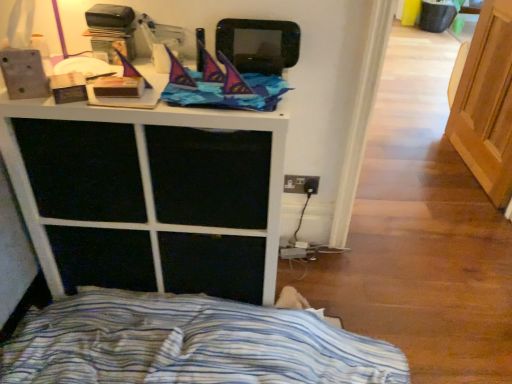
The width and height of the screenshot is (512, 384). Find the location of `blue striped fabric at lower left`. blue striped fabric at lower left is located at coordinates coord(191,343).

You are a GUI agent. You are given a task and a screenshot of the screen. Output one action in this format:
    pyautogui.click(x=<x>, y=<y>)
    Task: Click on the white matte cabinet at upper center
    Image resolution: width=512 pixels, height=384 pixels.
    Given the screenshot: What is the action you would take?
    pyautogui.click(x=149, y=195)

Can you confirm if light brown wood screen door at right is wider than white matte cabinet at upper center?

No, light brown wood screen door at right is not wider than white matte cabinet at upper center.

Is white matte cabinet at upper center inside light brown wood screen door at right?

No.

Considering the positions of objects light brown wood screen door at right and white matte cabinet at upper center in the image provided, who is more to the left, light brown wood screen door at right or white matte cabinet at upper center?

From the viewer's perspective, white matte cabinet at upper center appears more on the left side.

Relative to white matte cabinet at upper center, is light brown wood screen door at right in front or behind?

Clearly, light brown wood screen door at right is behind white matte cabinet at upper center.

From a real-world perspective, is white matte cabinet at upper center physically below light brown wood screen door at right?

Yes, from a real-world perspective, white matte cabinet at upper center is under light brown wood screen door at right.

At what (x,y) coordinates should I click in order to perform the action: click on furniture in front of the light brown wood screen door at right. Please return your answer as a coordinate pair (x, y). The image size is (512, 384). Looking at the image, I should click on (149, 195).

From the image's perspective, is white matte cabinet at upper center located above or below light brown wood screen door at right?

white matte cabinet at upper center is situated lower than light brown wood screen door at right in the image.

Considering the positions of points (272, 116) and (63, 342), is point (272, 116) farther from camera compared to point (63, 342)?

That is False.

Considering the positions of objects white matte cabinet at upper center and blue striped fabric at lower left in the image provided, who is more to the right, white matte cabinet at upper center or blue striped fabric at lower left?

blue striped fabric at lower left.

From the image's perspective, is white matte cabinet at upper center over blue striped fabric at lower left?

Yes, from the image's perspective, white matte cabinet at upper center is above blue striped fabric at lower left.

From a real-world perspective, which object rests below the other?

In real-world perspective, blue striped fabric at lower left is lower.

From the image's perspective, is light brown wood screen door at right positioned above or below blue striped fabric at lower left?

Clearly, from the image's perspective, light brown wood screen door at right is above blue striped fabric at lower left.

Is light brown wood screen door at right oriented towards blue striped fabric at lower left?

No, light brown wood screen door at right does not turn towards blue striped fabric at lower left.

Based on the photo, are light brown wood screen door at right and blue striped fabric at lower left making contact?

There is a gap between light brown wood screen door at right and blue striped fabric at lower left.

Image resolution: width=512 pixels, height=384 pixels. What are the coordinates of `screen door positioned vertically above the blue striped fabric at lower left (from a real-world perspective)` in the screenshot? It's located at (487, 104).

Which of these two, blue striped fabric at lower left or light brown wood screen door at right, is smaller?

With smaller size is light brown wood screen door at right.

Does blue striped fabric at lower left have a greater height compared to light brown wood screen door at right?

Incorrect, the height of blue striped fabric at lower left is not larger of that of light brown wood screen door at right.

Which object is further away from the camera, blue striped fabric at lower left or white matte cabinet at upper center?

blue striped fabric at lower left is further from the camera.

Is blue striped fabric at lower left wider than white matte cabinet at upper center?

Incorrect, the width of blue striped fabric at lower left does not surpass that of white matte cabinet at upper center.

From the image's perspective, between blue striped fabric at lower left and white matte cabinet at upper center, which one is located above?

white matte cabinet at upper center appears higher in the image.

Which is behind, point (71, 306) or point (236, 133)?

Positioned behind is point (71, 306).

Where is `furniture below the light brown wood screen door at right (from the image's perspective)`? furniture below the light brown wood screen door at right (from the image's perspective) is located at coordinates (149, 195).

Locate an element on the screen. furniture lying in front of the light brown wood screen door at right is located at coordinates 149,195.

From the picture: Which object lies further to the anchor point light brown wood screen door at right, blue striped fabric at lower left or white matte cabinet at upper center?

The object further to light brown wood screen door at right is white matte cabinet at upper center.

Looking at the image, which one is located further to light brown wood screen door at right, white matte cabinet at upper center or blue striped fabric at lower left?

Based on the image, white matte cabinet at upper center appears to be further to light brown wood screen door at right.

Which object lies further to the anchor point blue striped fabric at lower left, light brown wood screen door at right or white matte cabinet at upper center?

light brown wood screen door at right is positioned further to the anchor blue striped fabric at lower left.

Based on the photo, when comparing their distances from white matte cabinet at upper center, does blue striped fabric at lower left or light brown wood screen door at right seem further?

light brown wood screen door at right.

Which object lies nearer to the anchor point white matte cabinet at upper center, light brown wood screen door at right or blue striped fabric at lower left?

The object closer to white matte cabinet at upper center is blue striped fabric at lower left.

Estimate the real-world distances between objects in this image. Which object is further from blue striped fabric at lower left, white matte cabinet at upper center or light brown wood screen door at right?

light brown wood screen door at right is positioned further to the anchor blue striped fabric at lower left.

Identify the location of bed between white matte cabinet at upper center and light brown wood screen door at right. (191, 343).